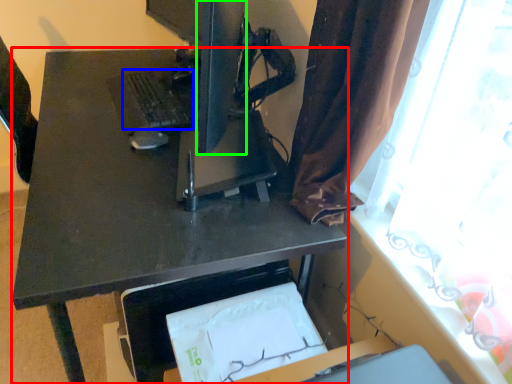
Question: Based on their relative distances, which object is farther from desk (highlighted by a red box)? Choose from laptop keyboard (highlighted by a blue box) and computer monitor (highlighted by a green box).

Choices:
 (A) laptop keyboard
 (B) computer monitor

Answer: (B)